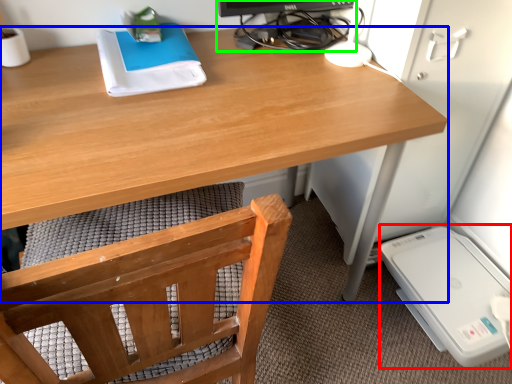
Question: Estimate the real-world distances between objects in this image. Which object is farther from appliance (highlighted by a red box), desk (highlighted by a blue box) or desktop computer (highlighted by a green box)?

Choices:
 (A) desk
 (B) desktop computer

Answer: (B)